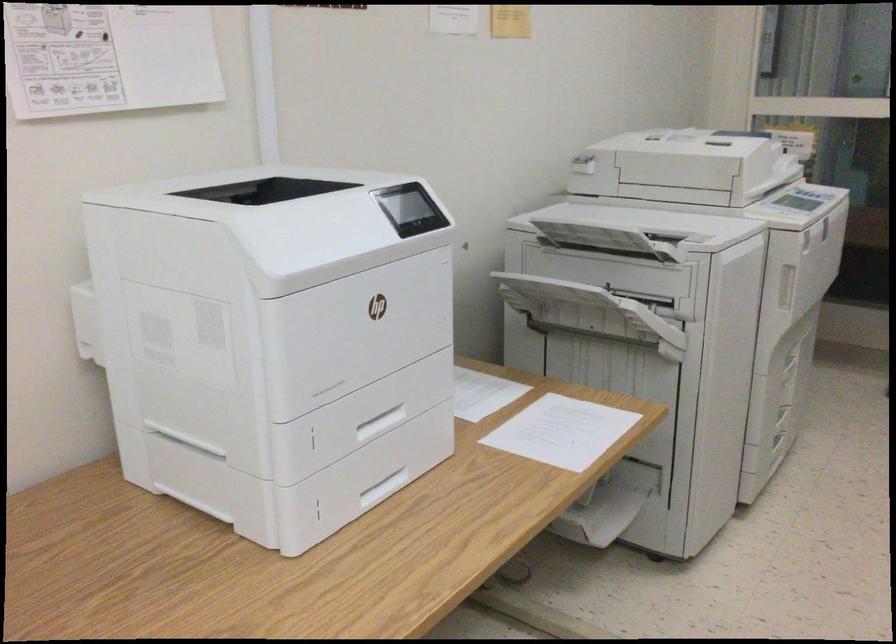
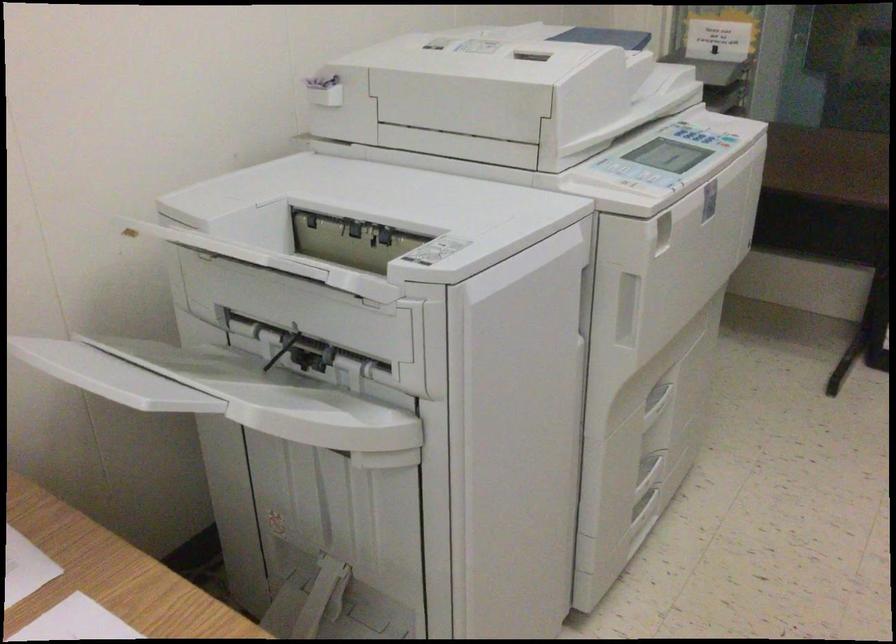
From the picture: Which direction would the cameraman need to move to produce the second image?

The movement direction of the cameraman is right, forward.